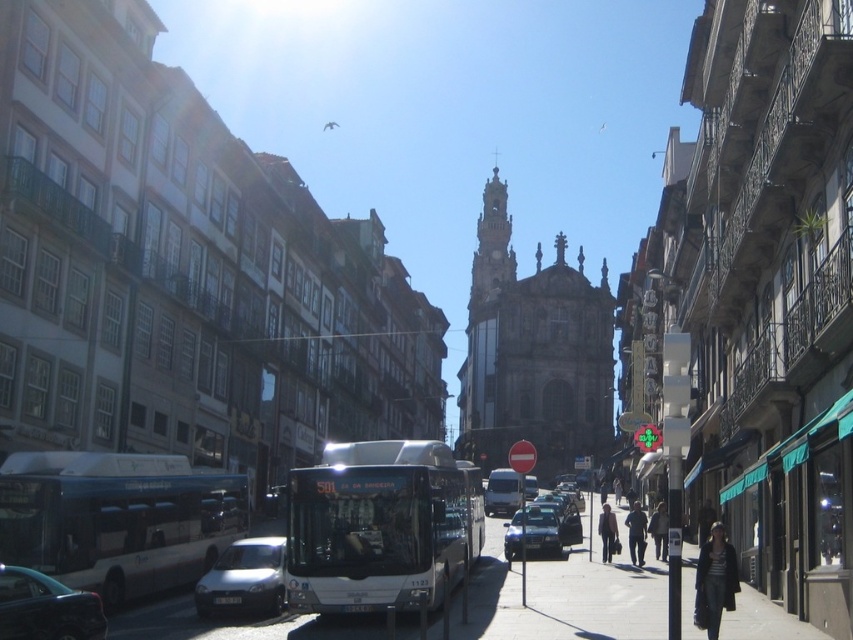
Question: Which point is closer to the camera?

Choices:
 (A) (514, 509)
 (B) (259, 538)
 (C) (42, 486)
 (D) (614, 477)

Answer: (C)

Question: In this image, where is smooth concrete sidewalk at center located relative to dark blue jeans at center?

Choices:
 (A) right
 (B) left

Answer: (B)

Question: Which object appears closest to the camera in this image?

Choices:
 (A) silver metallic car at center
 (B) metallic silver sedan at center

Answer: (A)

Question: Which object is farther from the camera taking this photo?

Choices:
 (A) dark blue jeans at center
 (B) dark gray sweater at lower right
 (C) white metallic bus at center
 (D) dark gray coat at center

Answer: (A)

Question: Is white metallic bus at center to the left of dark gray sweater at lower right from the viewer's perspective?

Choices:
 (A) yes
 (B) no

Answer: (A)

Question: Does shiny black sedan at lower left lie in front of white matte bus at center?

Choices:
 (A) yes
 (B) no

Answer: (A)